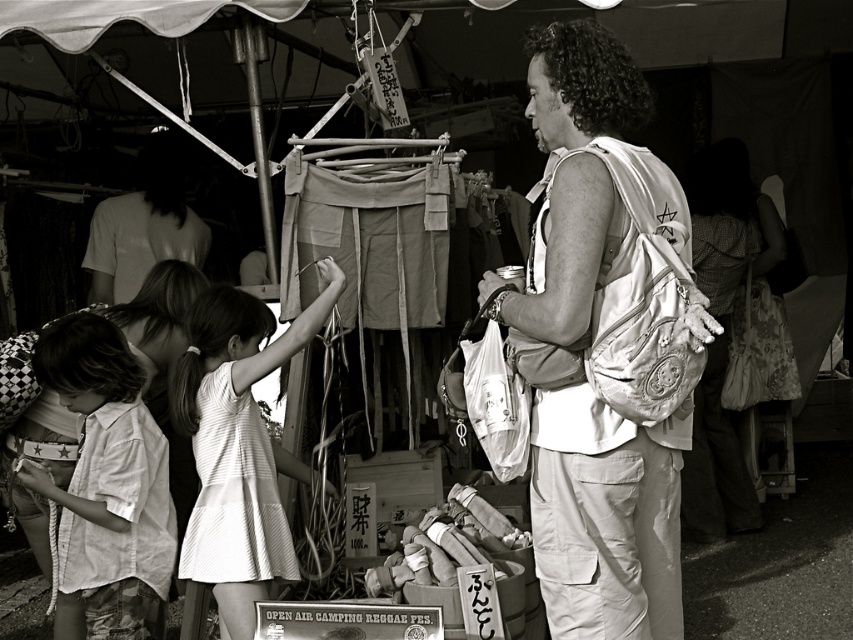
Question: Estimate the real-world distances between objects in this image. Which object is farther from the white cotton shirt at lower left?

Choices:
 (A) white cotton shirt at upper left
 (B) white fabric bag at center

Answer: (B)

Question: Is white fabric bag at center to the right of white cotton shirt at lower left from the viewer's perspective?

Choices:
 (A) no
 (B) yes

Answer: (B)

Question: Among these objects, which one is farthest from the camera?

Choices:
 (A) white cotton shirt at lower left
 (B) white cotton shirt at upper left
 (C) white striped dress at center
 (D) white fabric bag at center

Answer: (B)

Question: Estimate the real-world distances between objects in this image. Which object is closer to the white fabric bag at center?

Choices:
 (A) white cotton shirt at upper left
 (B) white cotton shirt at lower left

Answer: (B)

Question: Can you confirm if white fabric bag at center is thinner than white striped dress at center?

Choices:
 (A) no
 (B) yes

Answer: (A)

Question: Does white striped dress at center have a larger size compared to white cotton shirt at lower left?

Choices:
 (A) yes
 (B) no

Answer: (B)